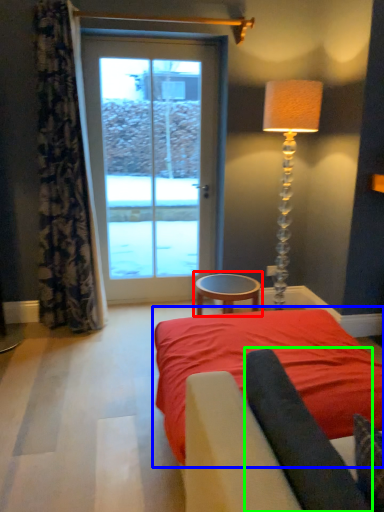
Question: Which object is the closest to the table (highlighted by a red box)? Choose among these: bed (highlighted by a blue box) or dark (highlighted by a green box).

Choices:
 (A) bed
 (B) dark

Answer: (A)